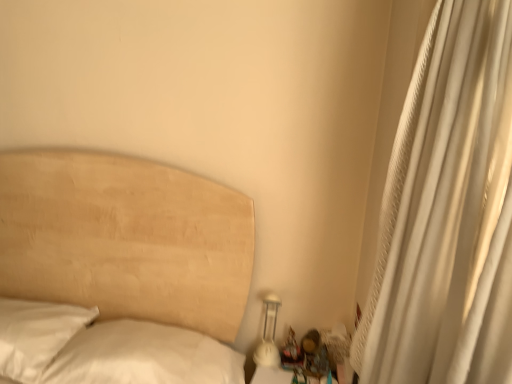
Question: Would you say white glossy bedside lamp at lower right contains white textured curtain at right?

Choices:
 (A) yes
 (B) no

Answer: (B)

Question: Can you confirm if white glossy bedside lamp at lower right is positioned to the left of white textured curtain at right?

Choices:
 (A) yes
 (B) no

Answer: (A)

Question: Is white glossy bedside lamp at lower right not close to white textured curtain at right?

Choices:
 (A) yes
 (B) no

Answer: (B)

Question: Can you confirm if white glossy bedside lamp at lower right is smaller than white textured curtain at right?

Choices:
 (A) no
 (B) yes

Answer: (B)

Question: Does white glossy bedside lamp at lower right touch white textured curtain at right?

Choices:
 (A) yes
 (B) no

Answer: (B)

Question: From a real-world perspective, is wooden figurine at lower right above or below white textured curtain at right?

Choices:
 (A) above
 (B) below

Answer: (B)

Question: In the image, is wooden figurine at lower right positioned in front of or behind white textured curtain at right?

Choices:
 (A) front
 (B) behind

Answer: (B)

Question: In the image, is wooden figurine at lower right on the left side or the right side of white textured curtain at right?

Choices:
 (A) left
 (B) right

Answer: (A)

Question: Choose the correct answer: Is wooden figurine at lower right inside white textured curtain at right or outside it?

Choices:
 (A) outside
 (B) inside

Answer: (A)

Question: From a real-world perspective, is wooden figurine at lower right positioned above or below white glossy bedside lamp at lower right?

Choices:
 (A) below
 (B) above

Answer: (A)

Question: Is wooden figurine at lower right in front of or behind white glossy bedside lamp at lower right in the image?

Choices:
 (A) behind
 (B) front

Answer: (B)

Question: Considering the positions of wooden figurine at lower right and white glossy bedside lamp at lower right in the image, is wooden figurine at lower right bigger or smaller than white glossy bedside lamp at lower right?

Choices:
 (A) big
 (B) small

Answer: (B)

Question: From the image's perspective, is wooden figurine at lower right above or below white glossy bedside lamp at lower right?

Choices:
 (A) above
 (B) below

Answer: (B)

Question: From a real-world perspective, is white textured curtain at right positioned above or below white glossy bedside lamp at lower right?

Choices:
 (A) above
 (B) below

Answer: (A)

Question: Relative to white glossy bedside lamp at lower right, is white textured curtain at right in front or behind?

Choices:
 (A) front
 (B) behind

Answer: (A)